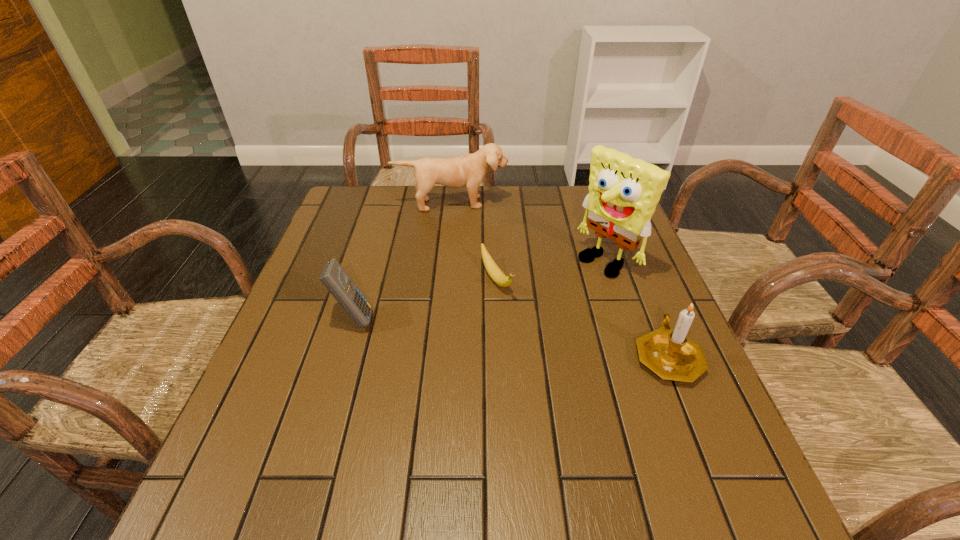
The width and height of the screenshot is (960, 540). What are the coordinates of `vacant space situated 0.150m on the left side of the puppy` in the screenshot? It's located at (461, 241).

The width and height of the screenshot is (960, 540). What are the coordinates of `vacant position located on the left side of the puppy` in the screenshot? It's located at (467, 287).

Identify the location of vacant space located on the left side of the puppy. (461, 246).

What are the coordinates of `free point located at the stem of the banana` in the screenshot? It's located at (558, 375).

Find the location of `vacant space situated at the stem of the banana`. vacant space situated at the stem of the banana is located at coordinates (533, 341).

Where is `vacant space situated at the stem of the banana`? Image resolution: width=960 pixels, height=540 pixels. vacant space situated at the stem of the banana is located at coordinates (540, 350).

This screenshot has height=540, width=960. In order to click on object present at the far edge in this screenshot , I will do `click(468, 170)`.

Find the location of a particular element. The image size is (960, 540). object positioned at the left edge is located at coordinates (333, 276).

Locate an element on the screen. This screenshot has height=540, width=960. candle holder that is positioned at the right edge is located at coordinates (670, 354).

At what (x,y) coordinates should I click in order to perform the action: click on sponge located in the right edge section of the desktop. Please return your answer as a coordinate pair (x, y). This screenshot has width=960, height=540. Looking at the image, I should click on (623, 192).